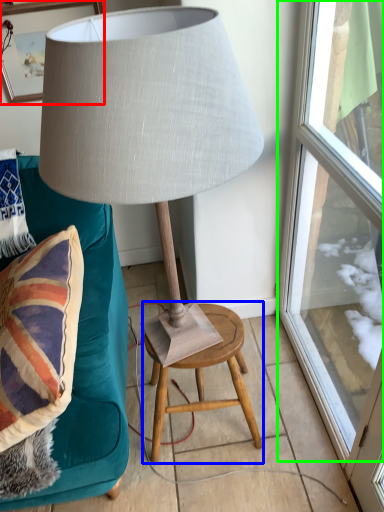
Question: Which object is positioned farthest from picture frame (highlighted by a red box)? Select from stool (highlighted by a blue box) and window (highlighted by a green box).

Choices:
 (A) stool
 (B) window

Answer: (A)